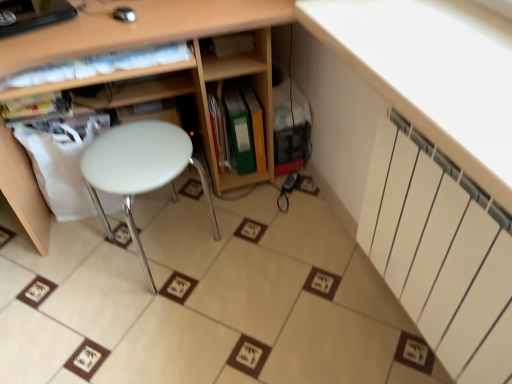
Where is `free area in between white plastic stool at center and green matte folder at center, which appears as the 2th book when viewed from the right`? Image resolution: width=512 pixels, height=384 pixels. free area in between white plastic stool at center and green matte folder at center, which appears as the 2th book when viewed from the right is located at coordinates (200, 206).